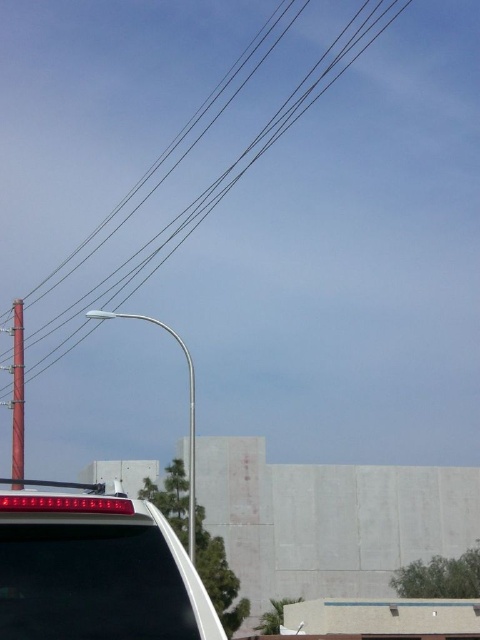
Question: Does matte black car at lower left have a larger size compared to black wire at upper left?

Choices:
 (A) no
 (B) yes

Answer: (A)

Question: Which object is the closest to the black wire at upper left?

Choices:
 (A) matte black car at lower left
 (B) smooth brown wooden pole at left

Answer: (B)

Question: Is matte black car at lower left thinner than smooth brown wooden pole at left?

Choices:
 (A) yes
 (B) no

Answer: (A)

Question: Among these objects, which one is farthest from the camera?

Choices:
 (A) smooth brown wooden pole at left
 (B) matte black car at lower left

Answer: (A)

Question: Based on their relative distances, which object is nearer to the smooth brown wooden pole at left?

Choices:
 (A) black wire at upper left
 (B) matte black car at lower left

Answer: (B)

Question: Is matte black car at lower left positioned behind smooth brown wooden pole at left?

Choices:
 (A) yes
 (B) no

Answer: (B)